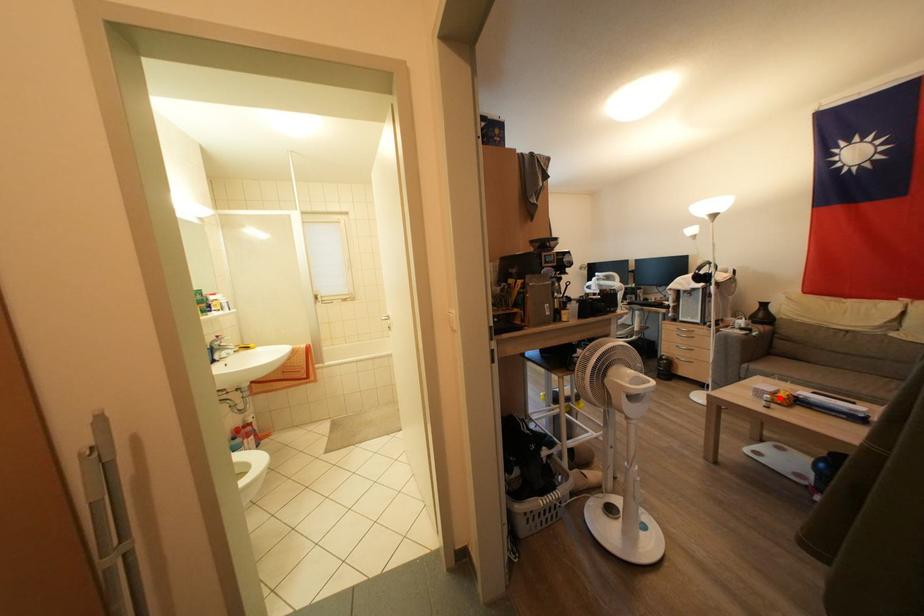
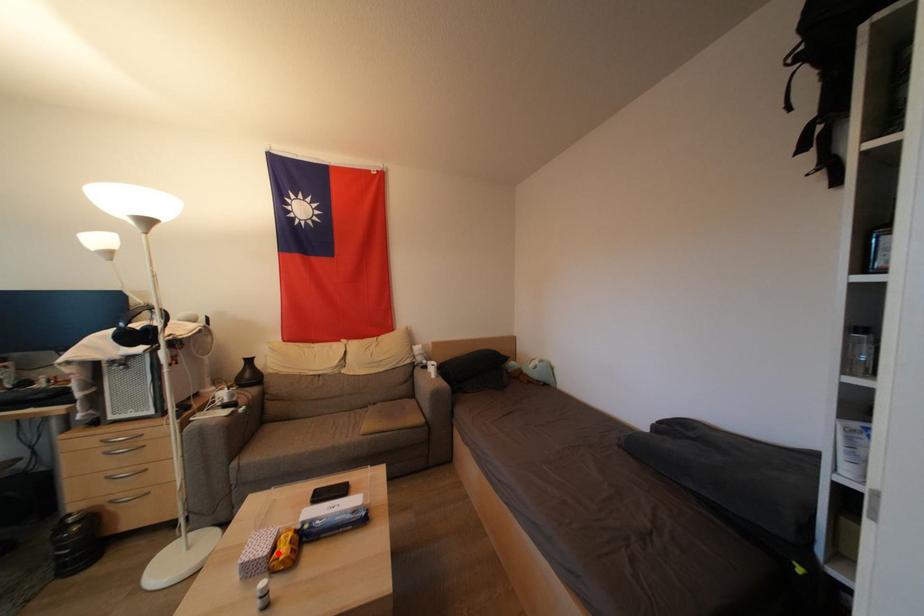
I am providing you with two images of the same scene from different viewpoints. A red point is marked on the first image and another point is marked on the second image. Is the marked point in image1 the same physical position as the marked point in image2?

Yes